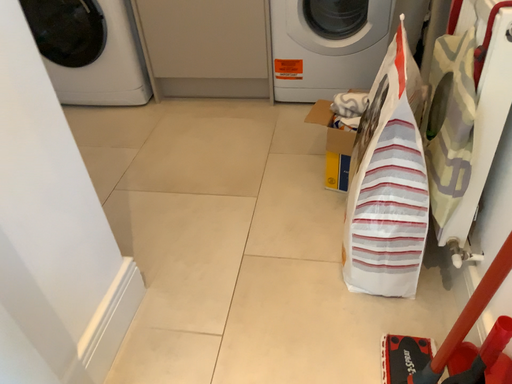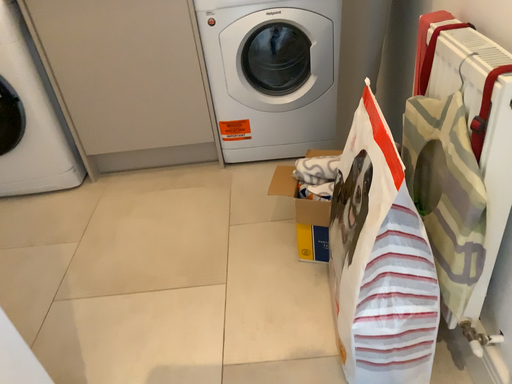
Question: Which way did the camera rotate in the video?

Choices:
 (A) rotated right
 (B) rotated left

Answer: (A)